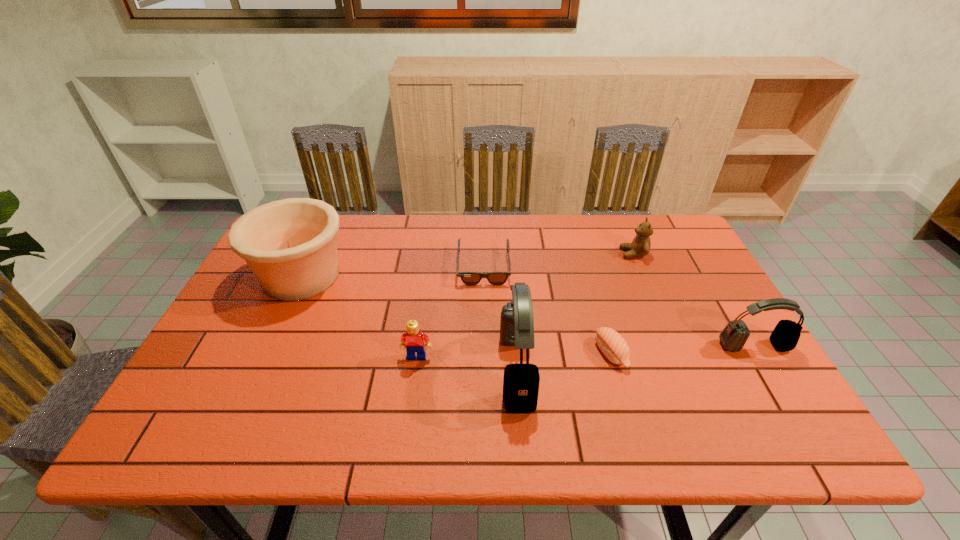
Observe the arrangement of all headsets in the image. To keep them evenly spaced, where would you place another headset on the left? Please locate a free space. Please provide its 2D coordinates. Your answer should be formatted as a tuple, i.e. [(x, y)], where the tuple contains the x and y coordinates of a point satisfying the conditions above.

[(253, 396)]